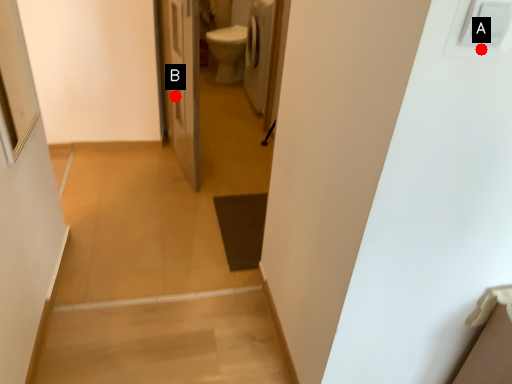
Question: Two points are circled on the image, labeled by A and B beside each circle. Which point is farther to the camera?

Choices:
 (A) A is further
 (B) B is further

Answer: (B)